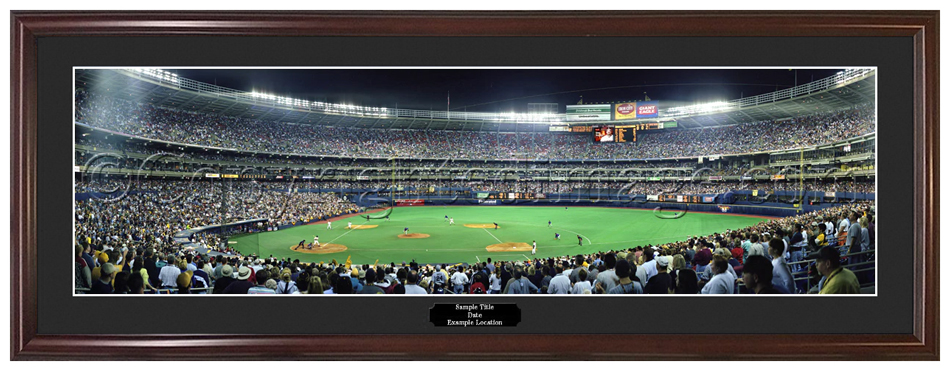
This screenshot has height=371, width=950. I want to click on white rectangular matting, so click(73, 162).